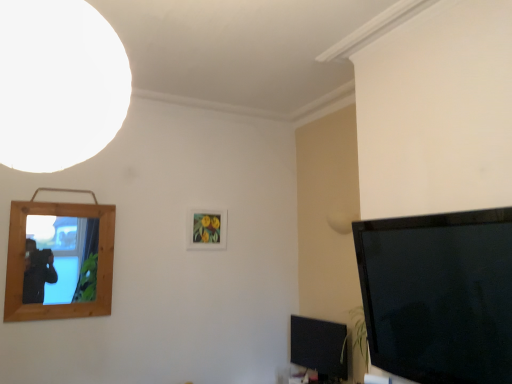
What is the approximate height of wooden mirror at left, acting as the first picture frame starting from the front?

29.88 inches.

Locate an element on the screen. matte wooden picture frame at center, positioned as the first picture frame in back-to-front order is located at coordinates (207, 229).

Who is more distant, wooden mirror at left, acting as the first picture frame starting from the front, or matte wooden picture frame at center, positioned as the first picture frame in back-to-front order?

matte wooden picture frame at center, positioned as the first picture frame in back-to-front order, is more distant.

Considering the sizes of wooden mirror at left, the first picture frame in the left-to-right sequence, and matte wooden picture frame at center, positioned as the first picture frame in back-to-front order, in the image, is wooden mirror at left, the first picture frame in the left-to-right sequence, taller or shorter than matte wooden picture frame at center, positioned as the first picture frame in back-to-front order,?

Clearly, wooden mirror at left, the first picture frame in the left-to-right sequence, is taller compared to matte wooden picture frame at center, positioned as the first picture frame in back-to-front order.

In the scene shown: Could you measure the distance between wooden mirror at left, the first picture frame in the left-to-right sequence, and matte wooden picture frame at center, positioned as the first picture frame in back-to-front order?

The distance of wooden mirror at left, the first picture frame in the left-to-right sequence, from matte wooden picture frame at center, positioned as the first picture frame in back-to-front order, is 30.18 inches.

Which object is wider, wooden mirror at left, which is the second picture frame in back-to-front order, or matte wooden picture frame at center, which is the first picture frame in right-to-left order?

With larger width is wooden mirror at left, which is the second picture frame in back-to-front order.

Considering the sizes of objects wooden mirror at left, acting as the first picture frame starting from the front, and black glossy tv at lower right in the image provided, who is taller, wooden mirror at left, acting as the first picture frame starting from the front, or black glossy tv at lower right?

With more height is wooden mirror at left, acting as the first picture frame starting from the front.

From the image's perspective, count 1st picture frames upward from the black glossy tv at lower right and point to it. Please provide its 2D coordinates.

[(59, 259)]

Is wooden mirror at left, acting as the first picture frame starting from the front, bigger than black glossy tv at lower right?

Correct, wooden mirror at left, acting as the first picture frame starting from the front, is larger in size than black glossy tv at lower right.

Consider the image. How different are the orientations of wooden mirror at left, placed as the 2th picture frame when sorted from right to left, and black glossy tv at lower right in degrees?

The facing directions of wooden mirror at left, placed as the 2th picture frame when sorted from right to left, and black glossy tv at lower right are 85.2 degrees apart.

How far apart are black glossy tv at lower right and wooden mirror at left, placed as the 2th picture frame when sorted from right to left?

black glossy tv at lower right and wooden mirror at left, placed as the 2th picture frame when sorted from right to left, are 1.48 meters apart.

Would you say black glossy tv at lower right is a long distance from wooden mirror at left, acting as the first picture frame starting from the front?

Yes, black glossy tv at lower right is far from wooden mirror at left, acting as the first picture frame starting from the front.

From the image's perspective, who appears lower, black glossy tv at lower right or wooden mirror at left, acting as the first picture frame starting from the front?

black glossy tv at lower right is shown below in the image.

Is black glossy tv at lower right to the left or to the right of wooden mirror at left, which is the second picture frame in back-to-front order, in the image?

Clearly, black glossy tv at lower right is on the right of wooden mirror at left, which is the second picture frame in back-to-front order, in the image.

Which is correct: wooden mirror at left, the first picture frame in the left-to-right sequence, is inside white matte light at upper left, or outside of it?

The correct answer is: outside.

From the image's perspective, which is above, wooden mirror at left, the first picture frame in the left-to-right sequence, or white matte light at upper left?

white matte light at upper left is shown above in the image.

From a real-world perspective, is wooden mirror at left, acting as the first picture frame starting from the front, positioned under white matte light at upper left based on gravity?

Yes, from a real-world perspective, wooden mirror at left, acting as the first picture frame starting from the front, is beneath white matte light at upper left.

How much distance is there between wooden mirror at left, acting as the first picture frame starting from the front, and white matte light at upper left?

They are 5.72 feet apart.

Based on the photo, is matte wooden picture frame at center, which is the first picture frame in right-to-left order, facing away from white matte light at upper left?

matte wooden picture frame at center, which is the first picture frame in right-to-left order, does not have its back to white matte light at upper left.

This screenshot has width=512, height=384. There is a white matte light at upper left. In order to click on the 1st picture frame below it (from the image's perspective) in this screenshot , I will do `click(207, 229)`.

Does matte wooden picture frame at center, the second picture frame from the left, come behind white matte light at upper left?

Yes.

Is point (223, 246) closer or farther from the camera than point (61, 20)?

Clearly, point (223, 246) is more distant from the camera than point (61, 20).

This screenshot has height=384, width=512. What are the coordinates of `television that appears in front of the matte wooden picture frame at center, positioned as the first picture frame in back-to-front order` in the screenshot? It's located at (320, 347).

From the image's perspective, is black glossy tv at lower right located above matte wooden picture frame at center, the second picture frame from the left?

No, from the image's perspective, black glossy tv at lower right is not on top of matte wooden picture frame at center, the second picture frame from the left.

What's the angular difference between black glossy tv at lower right and matte wooden picture frame at center, which is the first picture frame in right-to-left order,'s facing directions?

The angular difference between black glossy tv at lower right and matte wooden picture frame at center, which is the first picture frame in right-to-left order, is 85.3 degrees.

Which of these two, black glossy tv at lower right or matte wooden picture frame at center, positioned as the first picture frame in back-to-front order, stands shorter?

With less height is matte wooden picture frame at center, positioned as the first picture frame in back-to-front order.

From the picture: Which object is further away from the camera taking this photo, black glossy tv at lower right or white matte light at upper left?

black glossy tv at lower right is further away from the camera.

Is black glossy tv at lower right not inside white matte light at upper left?

Yes, black glossy tv at lower right is located beyond the bounds of white matte light at upper left.

Can you confirm if black glossy tv at lower right is thinner than white matte light at upper left?

Yes.

Between black glossy tv at lower right and white matte light at upper left, which one has larger size?

With larger size is white matte light at upper left.

The image size is (512, 384). Identify the location of picture frame below the matte wooden picture frame at center, the second picture frame from the left (from a real-world perspective). (59, 259).

Locate an element on the screen. The image size is (512, 384). television behind the wooden mirror at left, placed as the 2th picture frame when sorted from right to left is located at coordinates (320, 347).

Considering their positions, is matte wooden picture frame at center, the second picture frame from the left, positioned further to white matte light at upper left than black glossy tv at lower right?

black glossy tv at lower right lies further to white matte light at upper left than the other object.

From the image, which object appears to be farther from wooden mirror at left, which is the second picture frame in back-to-front order, matte wooden picture frame at center, positioned as the first picture frame in back-to-front order, or black glossy tv at lower right?

black glossy tv at lower right.

Estimate the real-world distances between objects in this image. Which object is further from white matte light at upper left, black glossy tv at lower right or matte wooden picture frame at center, which is the first picture frame in right-to-left order?

The object further to white matte light at upper left is black glossy tv at lower right.

Considering their positions, is black glossy tv at lower right positioned closer to wooden mirror at left, which is the second picture frame in back-to-front order, than white matte light at upper left?

black glossy tv at lower right lies closer to wooden mirror at left, which is the second picture frame in back-to-front order, than the other object.

From the image, which object appears to be nearer to wooden mirror at left, acting as the first picture frame starting from the front, white matte light at upper left or black glossy tv at lower right?

black glossy tv at lower right is closer to wooden mirror at left, acting as the first picture frame starting from the front.

From the image, which object appears to be nearer to matte wooden picture frame at center, positioned as the first picture frame in back-to-front order, black glossy tv at lower right or wooden mirror at left, which is the second picture frame in back-to-front order?

wooden mirror at left, which is the second picture frame in back-to-front order, is closer to matte wooden picture frame at center, positioned as the first picture frame in back-to-front order.

When comparing their distances from white matte light at upper left, does black glossy tv at lower right or wooden mirror at left, placed as the 2th picture frame when sorted from right to left, seem closer?

wooden mirror at left, placed as the 2th picture frame when sorted from right to left, lies closer to white matte light at upper left than the other object.

When comparing their distances from white matte light at upper left, does wooden mirror at left, placed as the 2th picture frame when sorted from right to left, or black glossy tv at lower right seem closer?

wooden mirror at left, placed as the 2th picture frame when sorted from right to left, is closer to white matte light at upper left.

Locate an element on the screen. picture frame between white matte light at upper left and black glossy tv at lower right in the front-back direction is located at coordinates (59, 259).

Where is `picture frame between wooden mirror at left, which is the second picture frame in back-to-front order, and black glossy tv at lower right`? The height and width of the screenshot is (384, 512). picture frame between wooden mirror at left, which is the second picture frame in back-to-front order, and black glossy tv at lower right is located at coordinates (207, 229).

This screenshot has width=512, height=384. I want to click on picture frame between white matte light at upper left and matte wooden picture frame at center, the second picture frame viewed from the front, in the front-back direction, so [x=59, y=259].

Find the location of `television located between white matte light at upper left and matte wooden picture frame at center, the second picture frame from the left, in the depth direction`. television located between white matte light at upper left and matte wooden picture frame at center, the second picture frame from the left, in the depth direction is located at coordinates (320, 347).